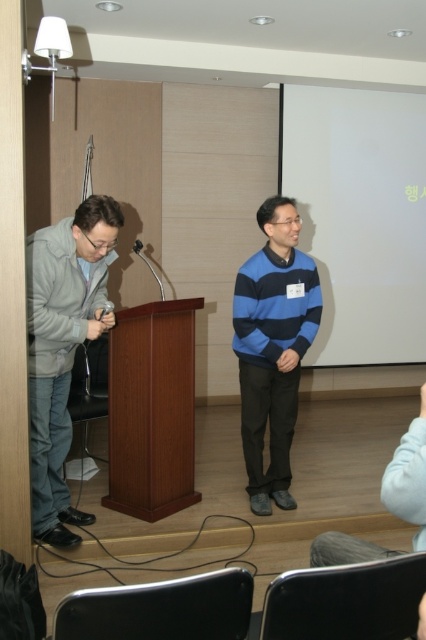
The image size is (426, 640). Describe the element at coordinates (63, 348) in the screenshot. I see `gray matte jacket at left` at that location.

Is point (57, 227) positioned in front of point (278, 490)?

Yes, it is in front of point (278, 490).

At what (x,y) coordinates should I click in order to perform the action: click on gray matte jacket at left. Please return your answer as a coordinate pair (x, y). Image resolution: width=426 pixels, height=640 pixels. Looking at the image, I should click on (63, 348).

At what (x,y) coordinates should I click in order to perform the action: click on gray matte jacket at left. Please return your answer as a coordinate pair (x, y). Looking at the image, I should click on (63, 348).

The width and height of the screenshot is (426, 640). Describe the element at coordinates (63, 348) in the screenshot. I see `gray matte jacket at left` at that location.

Is gray matte jacket at left shorter than matte black microphone at left?

Incorrect, gray matte jacket at left's height does not fall short of matte black microphone at left's.

Locate an element on the screen. The width and height of the screenshot is (426, 640). gray matte jacket at left is located at coordinates (63, 348).

Who is higher up, blue striped sweater at center or matte black microphone at left?

matte black microphone at left is above.

Which is in front, point (317, 282) or point (101, 312)?

Point (101, 312) is in front.

The height and width of the screenshot is (640, 426). Identify the location of blue striped sweater at center. (273, 348).